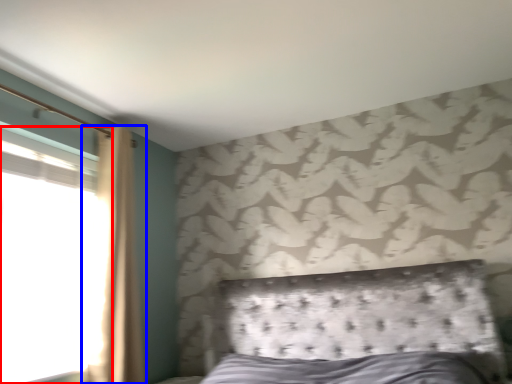
Question: Which point is closer to the camera, window (highlighted by a red box) or curtain (highlighted by a blue box)?

Choices:
 (A) window
 (B) curtain

Answer: (A)